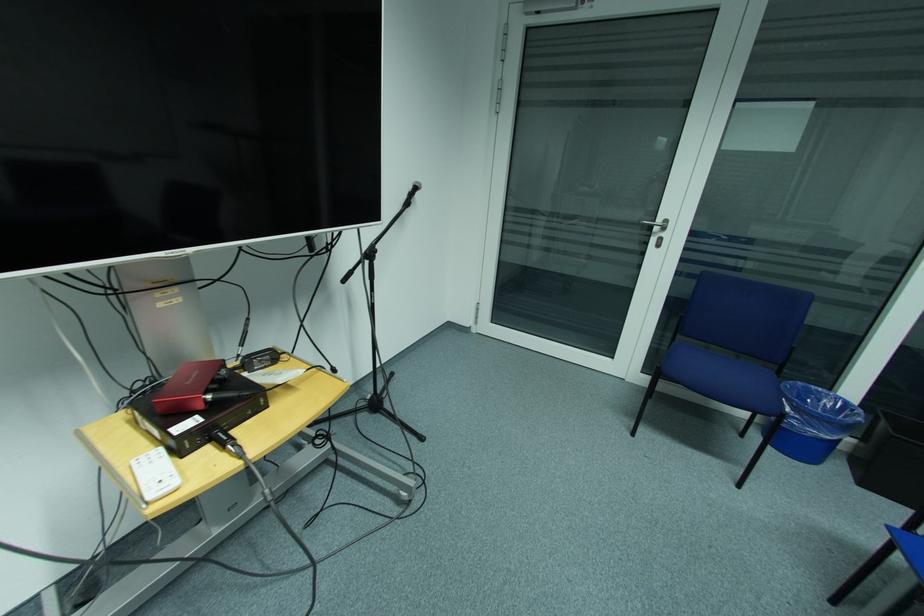
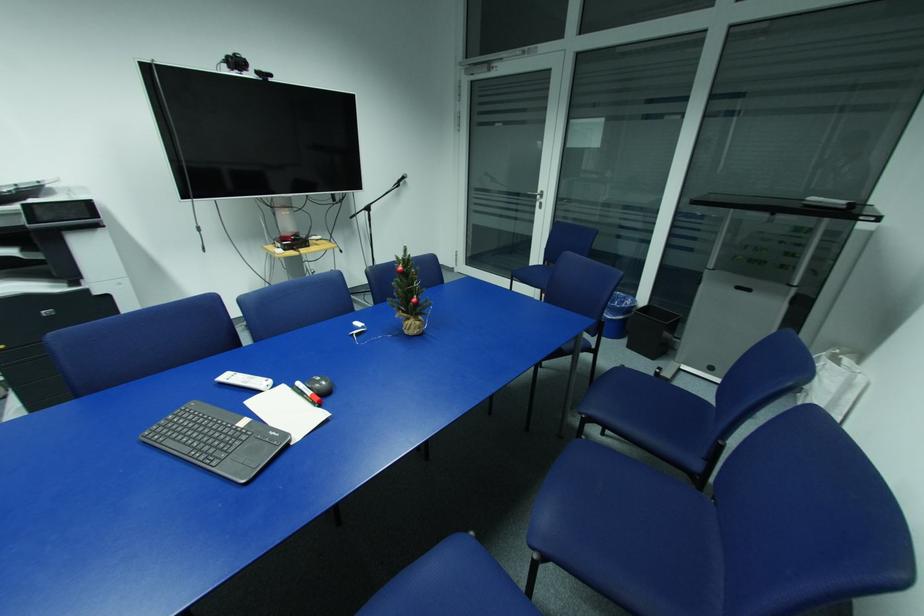
Which direction would the cameraman need to move to produce the second image?

The cameraman moved toward right, backward.